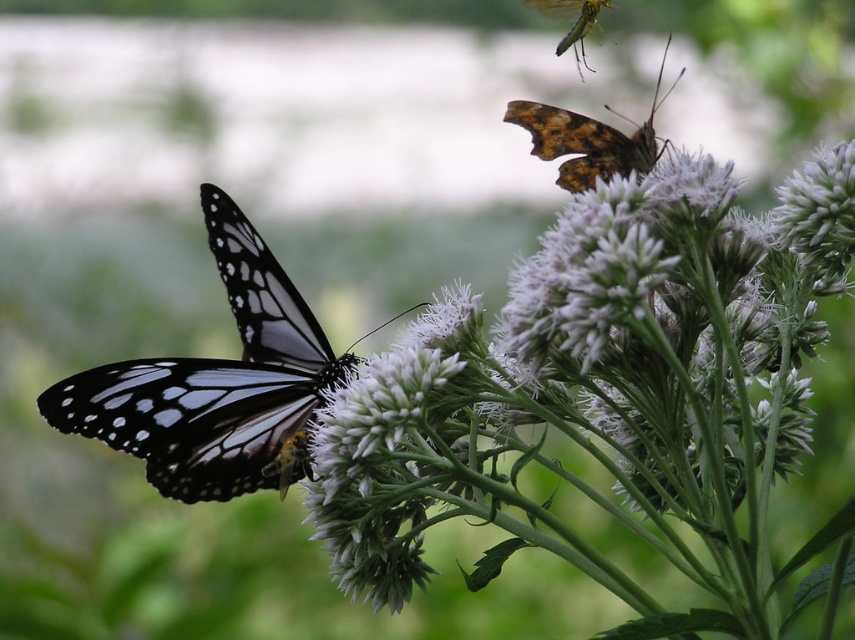
Does white fluffy flower at upper center have a greater width compared to translucent yellow-green dragonfly at upper right?

Correct, the width of white fluffy flower at upper center exceeds that of translucent yellow-green dragonfly at upper right.

The height and width of the screenshot is (640, 855). Describe the element at coordinates (606, 392) in the screenshot. I see `white fluffy flower at upper center` at that location.

Is point (673, 532) farther from camera compared to point (579, 24)?

No.

Image resolution: width=855 pixels, height=640 pixels. Identify the location of white fluffy flower at upper center. (606, 392).

Does white fluffy flower at upper center appear on the right side of brown textured butterfly at upper right?

Correct, you'll find white fluffy flower at upper center to the right of brown textured butterfly at upper right.

Is white fluffy flower at upper center smaller than brown textured butterfly at upper right?

Incorrect, white fluffy flower at upper center is not smaller in size than brown textured butterfly at upper right.

The image size is (855, 640). Describe the element at coordinates (606, 392) in the screenshot. I see `white fluffy flower at upper center` at that location.

You are a GUI agent. You are given a task and a screenshot of the screen. Output one action in this format:
    pyautogui.click(x=<x>, y=<y>)
    Task: Click on the white fluffy flower at upper center
    The height and width of the screenshot is (640, 855).
    Given the screenshot: What is the action you would take?
    pyautogui.click(x=606, y=392)

Does point (168, 472) come in front of point (550, 4)?

Yes.

Who is positioned more to the left, matte black and white butterfly at center or translucent yellow-green dragonfly at upper right?

matte black and white butterfly at center

Does point (292, 449) lie behind point (575, 12)?

No, it is not.

In order to click on matte black and white butterfly at center in this screenshot , I will do `click(215, 384)`.